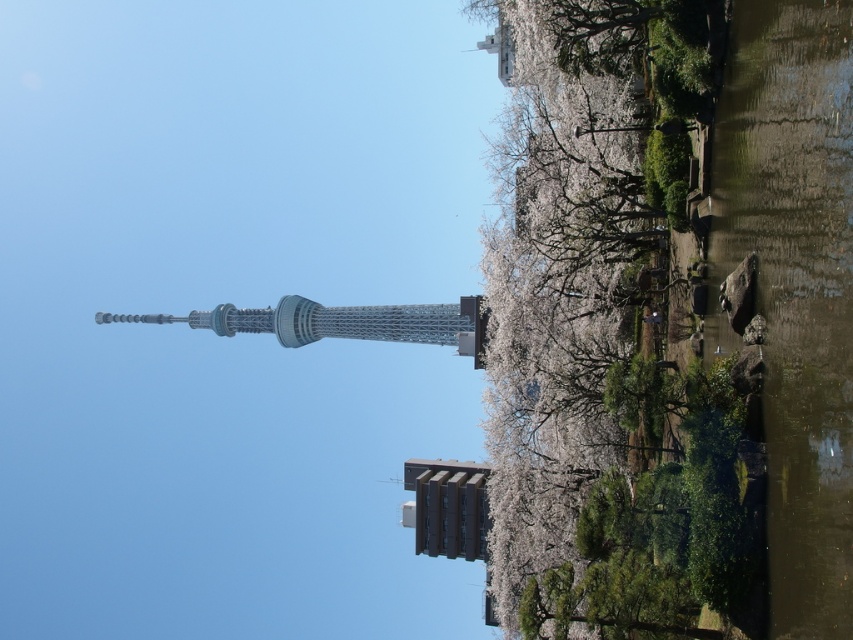
Who is shorter, white blossoming tree at center or metallic gray building at center?

metallic gray building at center

Is point (549, 205) positioned in front of point (418, 528)?

Yes, it is in front of point (418, 528).

Does point (664, 592) come closer to viewer compared to point (431, 515)?

Yes, point (664, 592) is closer to viewer.

This screenshot has height=640, width=853. In order to click on white blossoming tree at center in this screenshot , I will do `click(606, 346)`.

Is greenish-brown water at lower right above metallic silver tower at center?

Correct, greenish-brown water at lower right is located above metallic silver tower at center.

Can you confirm if greenish-brown water at lower right is shorter than metallic silver tower at center?

No.

The height and width of the screenshot is (640, 853). I want to click on greenish-brown water at lower right, so click(x=793, y=285).

Is white blossoming tree at center below greenish-brown water at lower right?

Yes, white blossoming tree at center is below greenish-brown water at lower right.

Can you confirm if white blossoming tree at center is smaller than greenish-brown water at lower right?

No, white blossoming tree at center is not smaller than greenish-brown water at lower right.

Image resolution: width=853 pixels, height=640 pixels. Describe the element at coordinates (606, 346) in the screenshot. I see `white blossoming tree at center` at that location.

Locate an element on the screen. This screenshot has width=853, height=640. white blossoming tree at center is located at coordinates (606, 346).